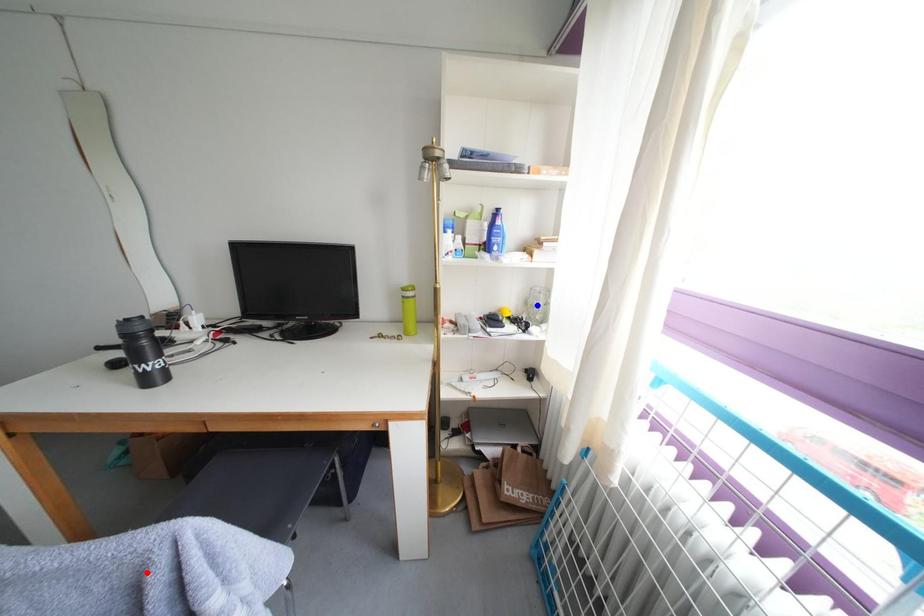
Question: In the image, two points are highlighted. Which point is nearer to the camera? Reply with the corresponding letter.

Choices:
 (A) blue point
 (B) red point

Answer: (B)